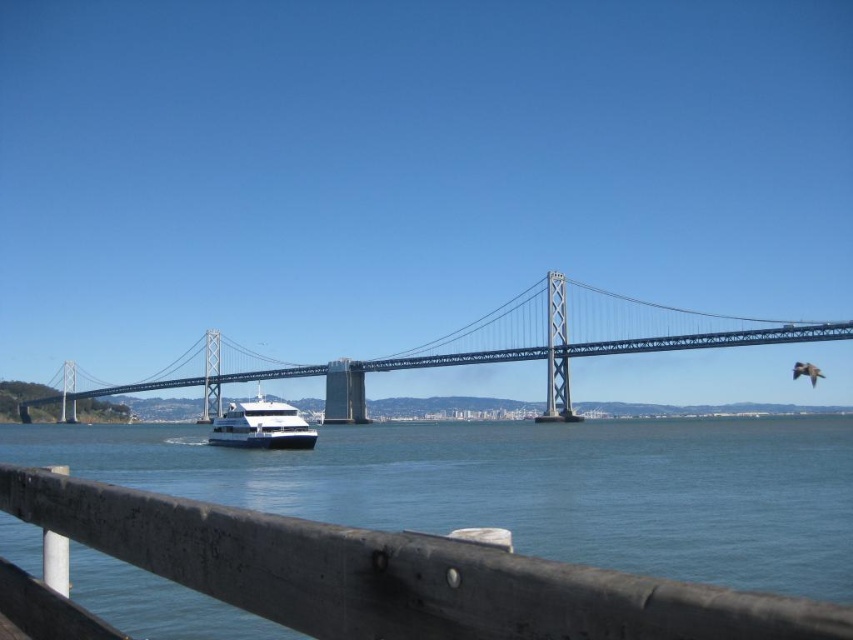
Question: Which of the following is the closest to the observer?

Choices:
 (A) (740, 616)
 (B) (276, 433)
 (C) (560, 291)

Answer: (A)

Question: Considering the relative positions of metallic gray bridge at center and white glossy cruise ship at center in the image provided, where is metallic gray bridge at center located with respect to white glossy cruise ship at center?

Choices:
 (A) left
 (B) right

Answer: (B)

Question: Which point is closer to the camera taking this photo?

Choices:
 (A) tap(49, 500)
 (B) tap(259, 436)
 (C) tap(209, 385)

Answer: (A)

Question: Considering the real-world distances, which object is farthest from the white glossy cruise ship at center?

Choices:
 (A) wooden rail at lower center
 (B) metallic gray bridge at center

Answer: (A)

Question: Is the position of wooden rail at lower center more distant than that of metallic gray bridge at center?

Choices:
 (A) yes
 (B) no

Answer: (B)

Question: Is wooden rail at lower center smaller than white glossy cruise ship at center?

Choices:
 (A) no
 (B) yes

Answer: (B)